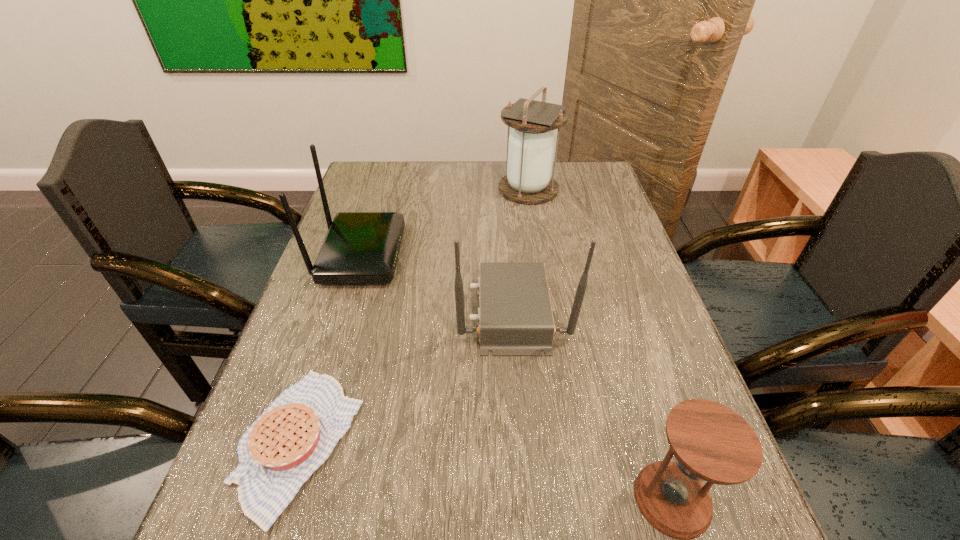
At what (x,y) coordinates should I click in order to perform the action: click on free space between the left router and the lantern. Please return your answer as a coordinate pair (x, y). Looking at the image, I should click on (444, 222).

The image size is (960, 540). In order to click on vacant space in between the farthest object and the left router in this screenshot , I will do [x=444, y=222].

Locate an element on the screen. Image resolution: width=960 pixels, height=540 pixels. vacant space in between the lantern and the pie is located at coordinates (414, 316).

In order to click on free space that is in between the right router and the shortest object in this screenshot , I will do `click(406, 377)`.

At what (x,y) coordinates should I click in order to perform the action: click on free space between the left router and the shortest object. Please return your answer as a coordinate pair (x, y). The image size is (960, 540). Looking at the image, I should click on (329, 348).

Select which object is the fourth closest to the farthest object. Please provide its 2D coordinates. Your answer should be formatted as a tuple, i.e. [(x, y)], where the tuple contains the x and y coordinates of a point satisfying the conditions above.

[(710, 442)]

Where is `object that stands as the third closest to the fourth tallest object`? object that stands as the third closest to the fourth tallest object is located at coordinates (360, 247).

You are a GUI agent. You are given a task and a screenshot of the screen. Output one action in this format:
    pyautogui.click(x=<x>, y=<y>)
    Task: Click on the vacant area in the image that satisfies the following two spatial constraints: 1. on the front-facing side of the left router; 2. on the front side of the shortest object
    The height and width of the screenshot is (540, 960).
    Given the screenshot: What is the action you would take?
    tap(301, 442)